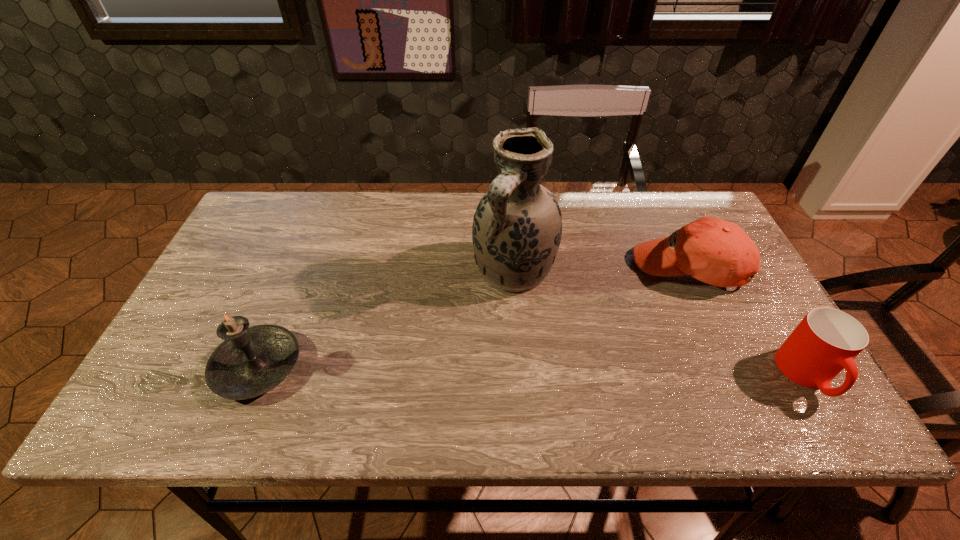
Find the location of a particular element. The height and width of the screenshot is (540, 960). free space on the desktop that is between the third shortest object and the cup and is positioned with the handle on the side of the second object from left to right is located at coordinates (456, 370).

Locate an element on the screen. This screenshot has width=960, height=540. vacant space on the desktop that is between the third shortest object and the cup and is positioned on the front-facing side of the baseball cap is located at coordinates (565, 372).